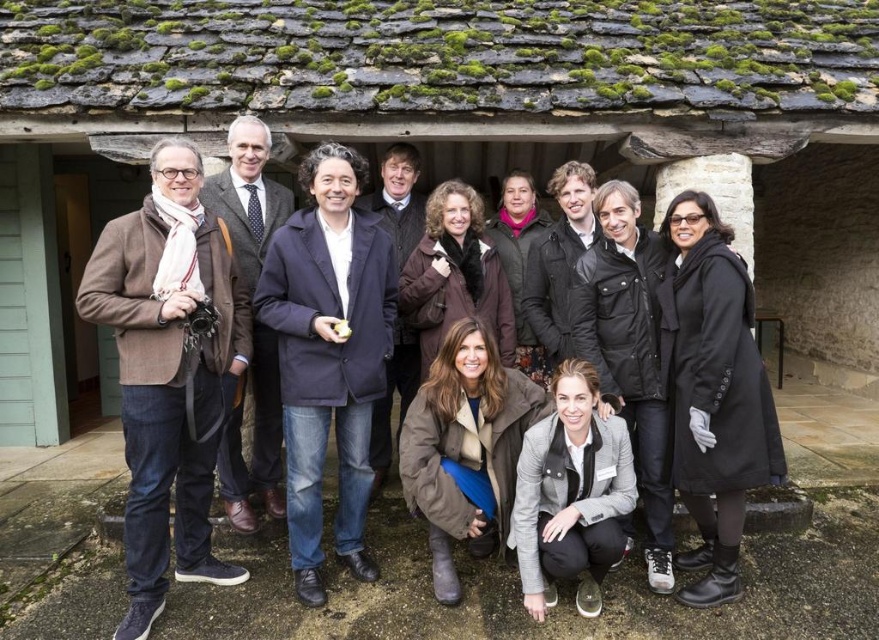
Question: Which object appears farthest from the camera in this image?

Choices:
 (A) navy blue coat at center
 (B) gray matte jacket at lower center

Answer: (A)

Question: Does black leather coat at right appear over matte blue coat at center?

Choices:
 (A) no
 (B) yes

Answer: (B)

Question: Can you confirm if black leather coat at right is positioned to the left of brown fuzzy coat at center?

Choices:
 (A) no
 (B) yes

Answer: (A)

Question: Which of the following is the farthest from the observer?

Choices:
 (A) (725, 474)
 (B) (202, 492)
 (C) (380, 202)

Answer: (C)

Question: Which point is farther to the camera?

Choices:
 (A) (531, 333)
 (B) (564, 452)
 (C) (338, 259)
 (D) (263, 136)

Answer: (A)

Question: In this image, where is brown woolen jacket at left located relative to black leather coat at right?

Choices:
 (A) right
 (B) left

Answer: (B)